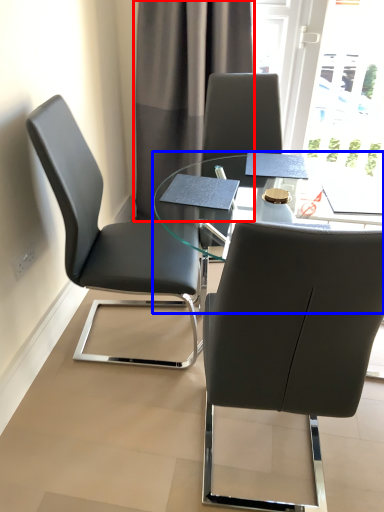
Question: Which of the following is the closest to the observer, curtain (highlighted by a red box) or table (highlighted by a blue box)?

Choices:
 (A) curtain
 (B) table

Answer: (B)